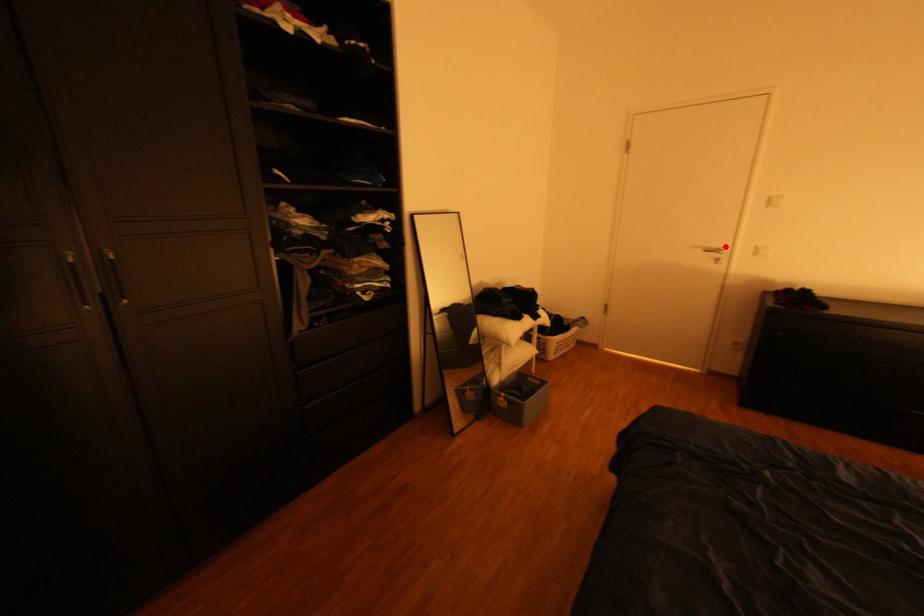
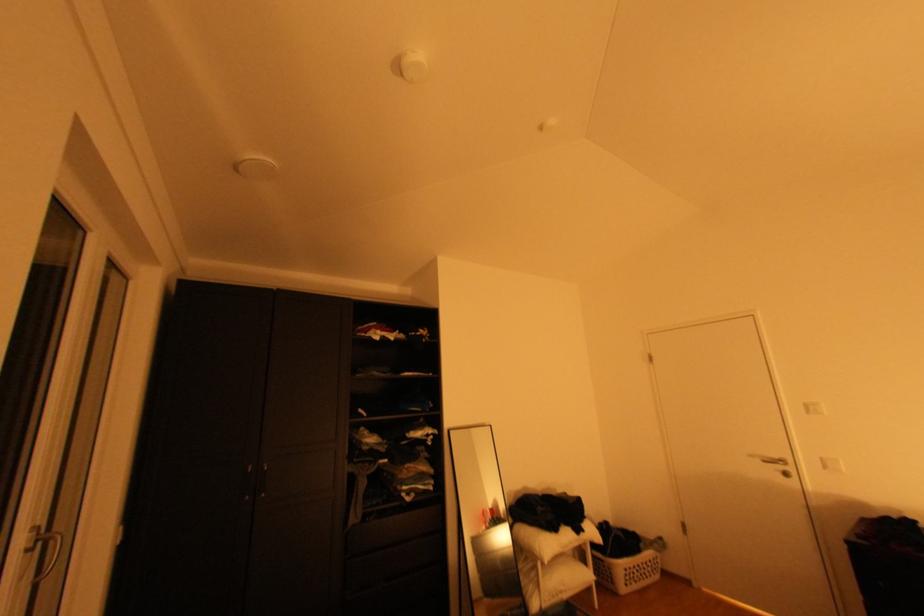
Question: I am providing you with two images of the same scene from different viewpoints. A red point is marked on the first image. At the location where the point appears in image 1, is it still visible in image 2?

Choices:
 (A) Yes
 (B) No

Answer: (A)